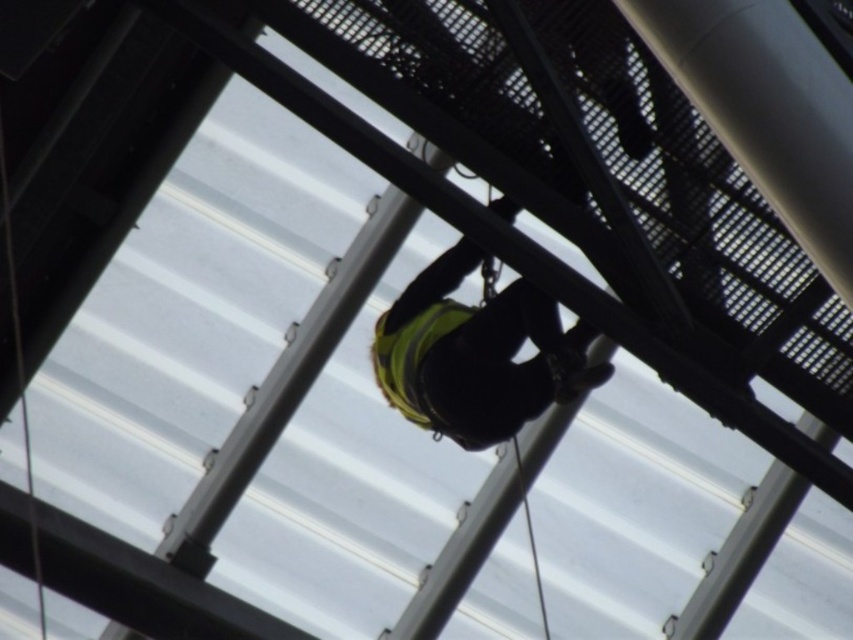
Question: In this image, where is yellow reflective vest at center located relative to yellow reflective safety vest at center?

Choices:
 (A) above
 (B) below

Answer: (A)

Question: Which object appears farthest from the camera in this image?

Choices:
 (A) yellow reflective safety vest at center
 (B) yellow reflective vest at center

Answer: (A)

Question: Is yellow reflective vest at center positioned before yellow reflective safety vest at center?

Choices:
 (A) yes
 (B) no

Answer: (A)

Question: Which point appears closest to the camera in this image?

Choices:
 (A) (434, 406)
 (B) (413, 362)

Answer: (A)

Question: Does yellow reflective vest at center come in front of yellow reflective safety vest at center?

Choices:
 (A) yes
 (B) no

Answer: (A)

Question: Which point is closer to the camera?

Choices:
 (A) (465, 378)
 (B) (398, 401)

Answer: (A)